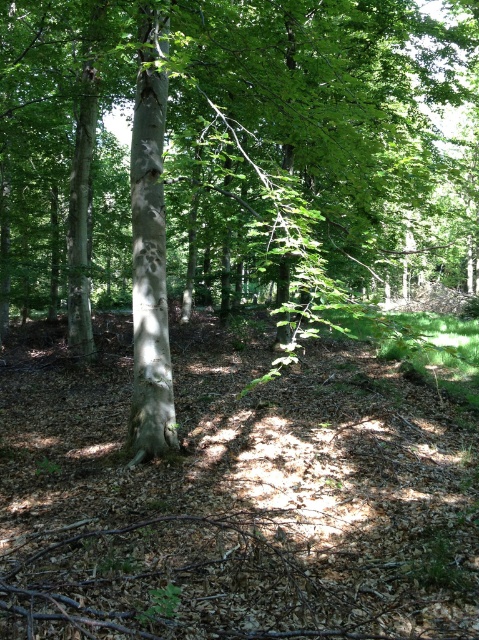
Question: Which of the following is the farthest from the observer?

Choices:
 (A) (166, 422)
 (B) (163, 38)

Answer: (A)

Question: Is green smooth tree trunk at center below smooth white bark at center?

Choices:
 (A) no
 (B) yes

Answer: (A)

Question: Among these points, which one is farthest from the camera?

Choices:
 (A) (167, 356)
 (B) (321, 148)

Answer: (A)

Question: Is green smooth tree trunk at center below smooth white bark at center?

Choices:
 (A) yes
 (B) no

Answer: (B)

Question: Is green smooth tree trunk at center thinner than smooth white bark at center?

Choices:
 (A) no
 (B) yes

Answer: (A)